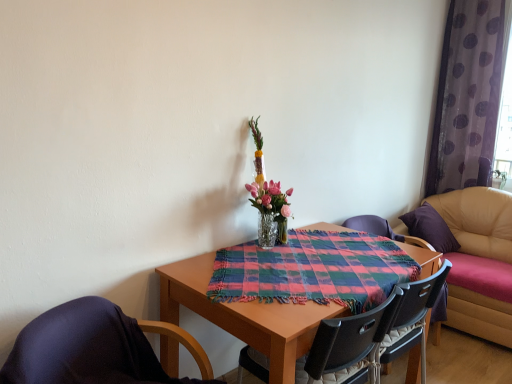
Question: In which direction should I rotate to look at black plastic chair at center, the 2th chair in the left-to-right sequence?

Choices:
 (A) left
 (B) right

Answer: (B)

Question: From the image's perspective, does black plastic chair at center, the 2th chair in the left-to-right sequence, appear lower than leather couch at right?

Choices:
 (A) no
 (B) yes

Answer: (B)

Question: Is the surface of black plastic chair at center, the 2th chair in the left-to-right sequence, in direct contact with leather couch at right?

Choices:
 (A) yes
 (B) no

Answer: (B)

Question: Is black plastic chair at center, which is the 2th chair in back-to-front order, outside of leather couch at right?

Choices:
 (A) yes
 (B) no

Answer: (A)

Question: Is black plastic chair at center, which is the 2th chair in back-to-front order, not near leather couch at right?

Choices:
 (A) yes
 (B) no

Answer: (A)

Question: Can you confirm if black plastic chair at center, which is the 2th chair in back-to-front order, is shorter than leather couch at right?

Choices:
 (A) yes
 (B) no

Answer: (A)

Question: Is black plastic chair at center, which is the second chair from front to back, further to the viewer compared to leather couch at right?

Choices:
 (A) yes
 (B) no

Answer: (B)

Question: Is clear glass vase at center taller than purple fabric-covered chair at lower left, which is the 3th chair in back-to-front order?

Choices:
 (A) no
 (B) yes

Answer: (B)

Question: Can you confirm if clear glass vase at center is bigger than purple fabric-covered chair at lower left, which is counted as the first chair, starting from the left?

Choices:
 (A) yes
 (B) no

Answer: (B)

Question: Is the depth of clear glass vase at center less than that of purple fabric-covered chair at lower left, the 1th chair when ordered from front to back?

Choices:
 (A) no
 (B) yes

Answer: (A)

Question: Is clear glass vase at center shorter than purple fabric-covered chair at lower left, which is counted as the first chair, starting from the left?

Choices:
 (A) yes
 (B) no

Answer: (B)

Question: Does clear glass vase at center appear on the right side of purple fabric-covered chair at lower left, which is the 3th chair in back-to-front order?

Choices:
 (A) yes
 (B) no

Answer: (A)

Question: Is clear glass vase at center wider than purple fabric-covered chair at lower left, the 1th chair when ordered from front to back?

Choices:
 (A) yes
 (B) no

Answer: (B)

Question: Does clear glass vase at center come in front of purple sheer curtain at right?

Choices:
 (A) no
 (B) yes

Answer: (B)